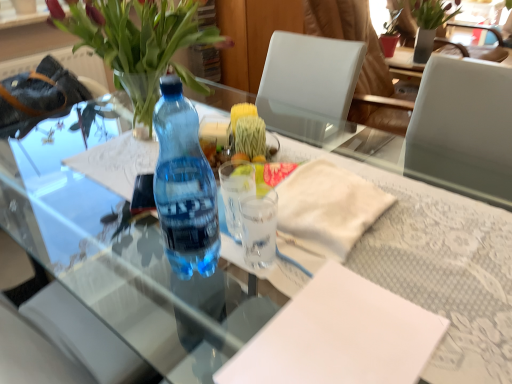
Question: From the image's perspective, relative to transparent plastic bottle at center, is white paper at center, positioned as the second notepad in back-to-front order, above or below?

Choices:
 (A) above
 (B) below

Answer: (B)

Question: Considering their positions, is white paper at center, which is the 1th notepad from front to back, located in front of or behind transparent plastic bottle at center?

Choices:
 (A) front
 (B) behind

Answer: (A)

Question: Which object is the closest to the white paper at center, marked as the 1th notepad in a back-to-front arrangement?

Choices:
 (A) green matte vase at upper right
 (B) transparent plastic bottle at center
 (C) transparent glass cup at center, arranged as the first coffee cup when viewed from the back
 (D) transparent glass cup at center, acting as the 1th coffee cup starting from the front
 (E) translucent glass vase at upper left

Answer: (D)

Question: Based on their relative distances, which object is farther from the transparent glass cup at center, acting as the 1th coffee cup starting from the front?

Choices:
 (A) translucent glass vase at upper left
 (B) green matte vase at upper right
 (C) white paper at center, the first notepad when ordered from top to bottom
 (D) white paper at center, positioned as the second notepad in back-to-front order
 (E) transparent glass cup at center, arranged as the first coffee cup when viewed from the back

Answer: (B)